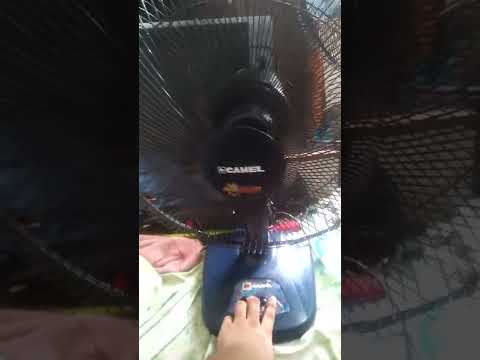
Where is `pink fabric left of fan base`? The image size is (480, 360). pink fabric left of fan base is located at coordinates (175, 250), (170, 248).